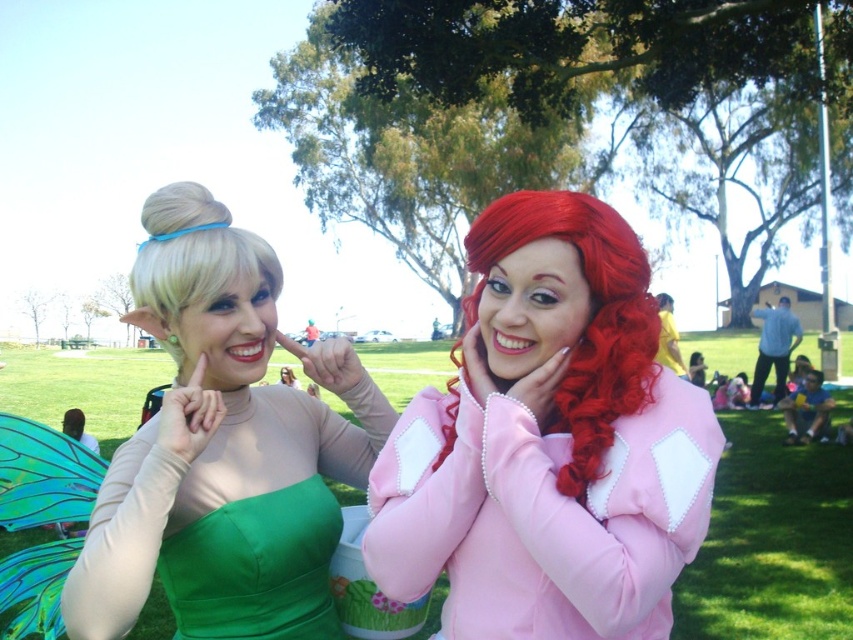
You are a photographer at a cosplay event. You need to position a spotlight exactly at the center of the green satin dress at left. What are the coordinates where you should place the spotlight?

The coordinates for the center of the green satin dress at left are at point (223, 449).

You are a photographer trying to capture a clear shot of both the Tinker Bell costume and the Ariel costume. You notice two points marked in the image. The first point is at coordinate point (345, 376) and the second is at point (619, 248). Based on their positions, which point should you focus on to ensure both costumes are in focus?

Point (345, 376) is further to the viewer than point (619, 248). To ensure both costumes are in focus, focus on the closer point, point (345, 376), since it is nearer to the camera and will keep both points within the depth of field.

You are standing in the middle of a cosplay event and notice two Disney characters. One is Tinker Bell on the left and the other is Ariel on the right. There is a specific point at coordinates [589,320] in the image. Which Disney character is closer to this point?

The curly matte red hair at center belongs to Ariel on the right, so the Disney character closer to the point is Ariel on the right.